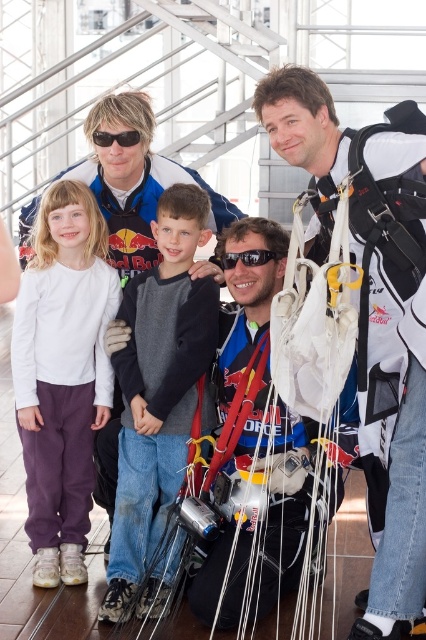
You are standing in the room and want to reach the white parachute at right. What are the coordinates where you should look?

The white parachute at right is located at coordinates point [374,314].

Looking at the scene with the white parachute at right and the black plastic sunglasses at upper left, which object is positioned further to the right?

The white parachute at right is positioned further to the right than the black plastic sunglasses at upper left.